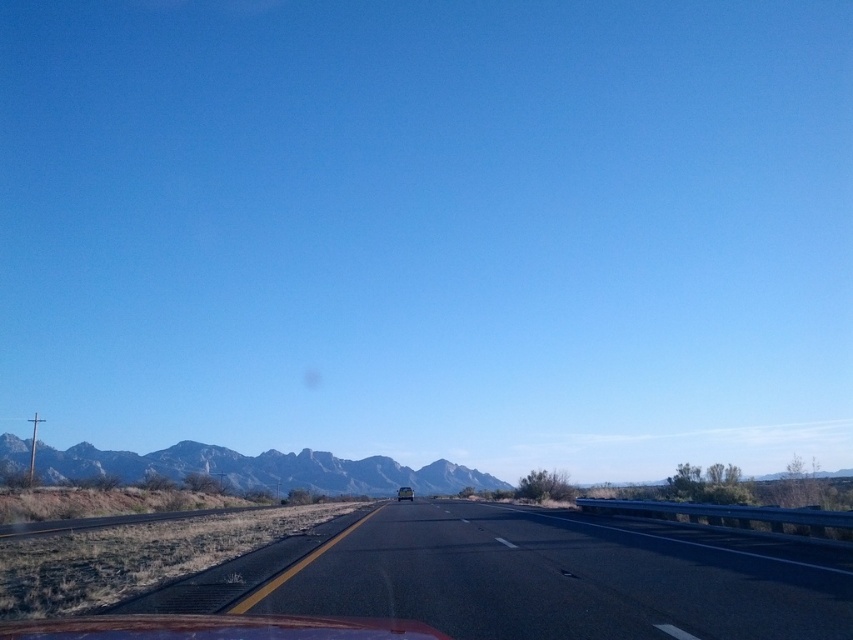
You are driving a shiny silver sedan at center and want to know if you can fit between two rugged brown mountains at center. Can you? Please explain.

The rugged brown mountains at center are wider than the shiny silver sedan at center, so yes, the sedan can fit between them since the mountains are wider.

You are a driver planning to cross the black asphalt highway at center and the rugged brown mountains at center. Which one is wider from your viewpoint?

The black asphalt highway at center has a lesser width compared to rugged brown mountains at center, so the rugged brown mountains at center are wider from your viewpoint.